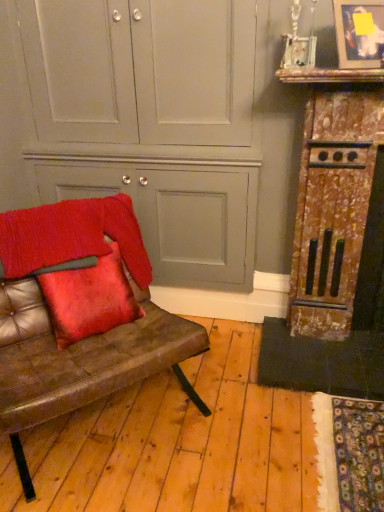
Question: Is velvet red pillow at left at the left side of rusty metal fireplace at right, marked as the first dresser in a right-to-left arrangement?

Choices:
 (A) yes
 (B) no

Answer: (A)

Question: From a real-world perspective, is velvet red pillow at left under rusty metal fireplace at right, which ranks as the second dresser in left-to-right order?

Choices:
 (A) no
 (B) yes

Answer: (B)

Question: Is velvet red pillow at left touching rusty metal fireplace at right, marked as the first dresser in a right-to-left arrangement?

Choices:
 (A) no
 (B) yes

Answer: (A)

Question: Is velvet red pillow at left positioned before rusty metal fireplace at right, which ranks as the second dresser in left-to-right order?

Choices:
 (A) no
 (B) yes

Answer: (B)

Question: Is rusty metal fireplace at right, marked as the first dresser in a right-to-left arrangement, a part of velvet red pillow at left?

Choices:
 (A) yes
 (B) no

Answer: (B)

Question: Is the position of velvet red pillow at left more distant than that of rusty metal fireplace at right, marked as the first dresser in a right-to-left arrangement?

Choices:
 (A) no
 (B) yes

Answer: (A)

Question: Considering the relative sizes of matte gray cabinet at center, placed as the first dresser when sorted from left to right, and metallic silver picture frame at upper right in the image provided, is matte gray cabinet at center, placed as the first dresser when sorted from left to right, taller than metallic silver picture frame at upper right?

Choices:
 (A) yes
 (B) no

Answer: (A)

Question: Is matte gray cabinet at center, which appears as the second dresser when viewed from the right, smaller than metallic silver picture frame at upper right?

Choices:
 (A) no
 (B) yes

Answer: (A)

Question: Is matte gray cabinet at center, which appears as the second dresser when viewed from the right, positioned behind metallic silver picture frame at upper right?

Choices:
 (A) no
 (B) yes

Answer: (B)

Question: Is matte gray cabinet at center, placed as the first dresser when sorted from left to right, closer to camera compared to metallic silver picture frame at upper right?

Choices:
 (A) no
 (B) yes

Answer: (A)

Question: Is matte gray cabinet at center, which appears as the second dresser when viewed from the right, in contact with metallic silver picture frame at upper right?

Choices:
 (A) yes
 (B) no

Answer: (B)

Question: From the image's perspective, does matte gray cabinet at center, placed as the first dresser when sorted from left to right, appear lower than metallic silver picture frame at upper right?

Choices:
 (A) yes
 (B) no

Answer: (A)

Question: Is there a large distance between leather couch at left and metallic silver picture frame at upper right?

Choices:
 (A) no
 (B) yes

Answer: (B)